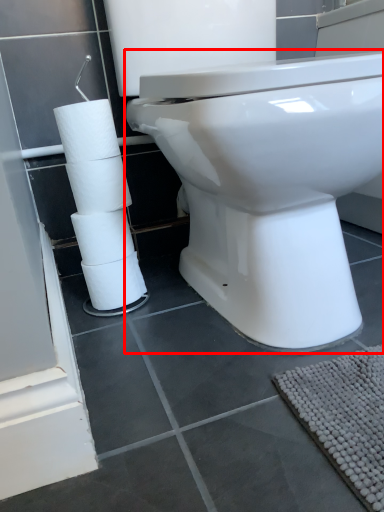
Question: In this image, where is toilet (annotated by the red box) located relative to toilet paper?

Choices:
 (A) left
 (B) right

Answer: (B)